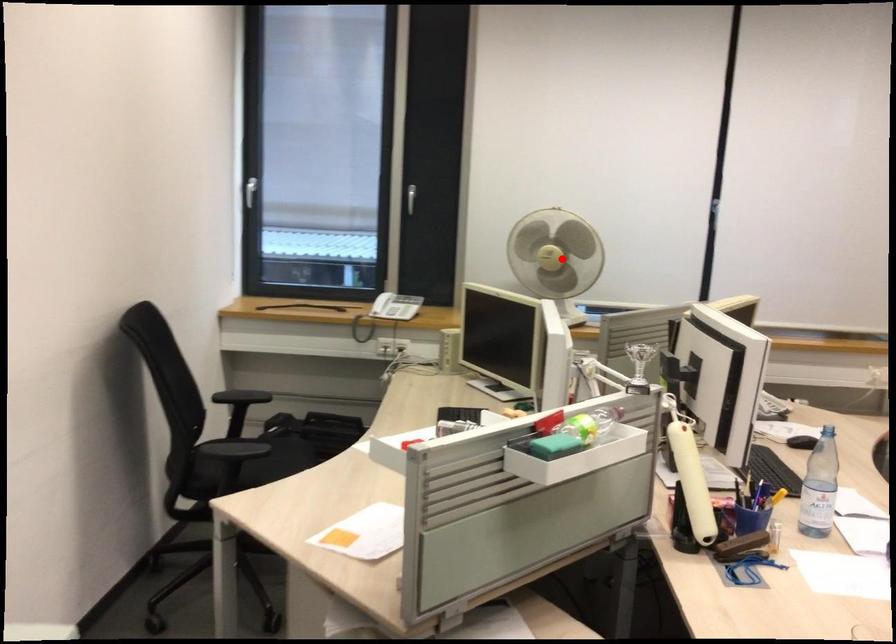
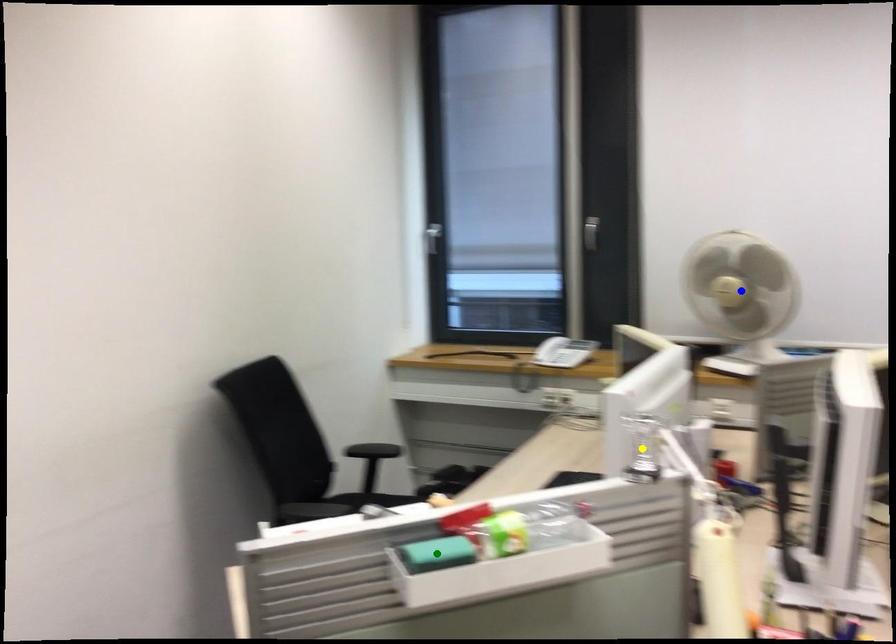
Question: I am providing you with two images of the same scene from different viewpoints. A red point is marked on the first image. You are given multiple points on the second image. Which spot in image 2 lines up with the point in image 1?

Choices:
 (A) green point
 (B) blue point
 (C) yellow point

Answer: (B)